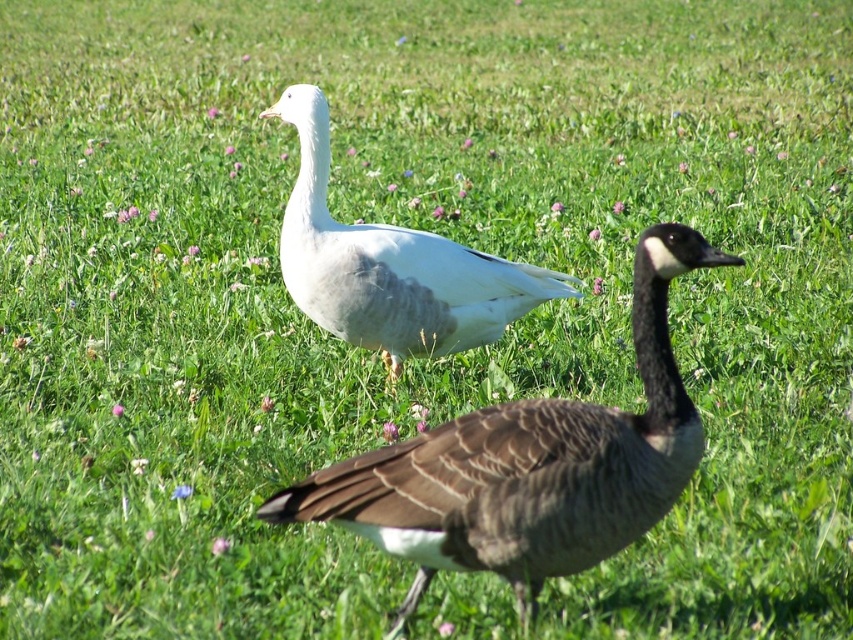
Can you confirm if white feathered goose at upper center is thinner than white matte goose at center?

Yes.

Consider the image. Between white feathered goose at upper center and white matte goose at center, which one appears on the left side from the viewer's perspective?

white matte goose at center is more to the left.

Where is `white feathered goose at upper center`? white feathered goose at upper center is located at coordinates (529, 465).

Locate an element on the screen. The width and height of the screenshot is (853, 640). white feathered goose at upper center is located at coordinates (529, 465).